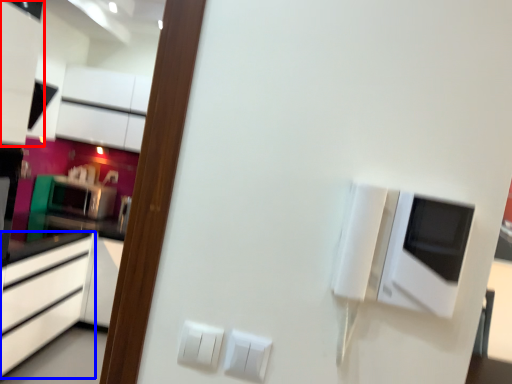
Question: Which object is further to the camera taking this photo, cabinetry (highlighted by a red box) or cabinetry (highlighted by a blue box)?

Choices:
 (A) cabinetry
 (B) cabinetry

Answer: (A)